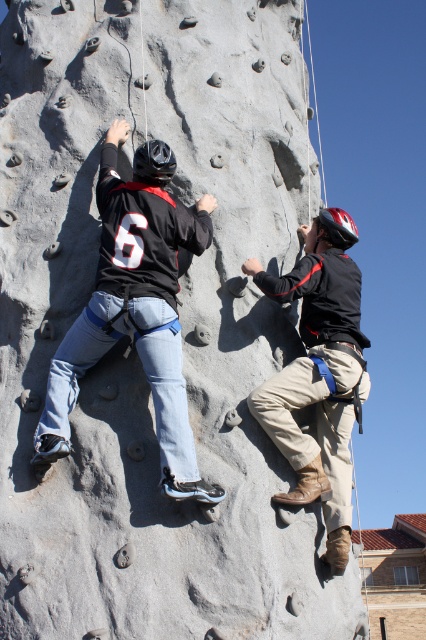
Question: From the image, what is the correct spatial relationship of matte black helmet at upper left in relation to matte black helmet at upper center?

Choices:
 (A) below
 (B) above

Answer: (B)

Question: Does matte black helmet at upper left come behind matte black helmet at upper center?

Choices:
 (A) yes
 (B) no

Answer: (B)

Question: Which object appears farthest from the camera in this image?

Choices:
 (A) matte black helmet at upper center
 (B) matte black helmet at upper left

Answer: (A)

Question: Does matte black helmet at upper left have a greater width compared to matte black helmet at upper center?

Choices:
 (A) no
 (B) yes

Answer: (B)

Question: Which object is closer to the camera taking this photo?

Choices:
 (A) matte black helmet at upper center
 (B) matte black helmet at upper left

Answer: (B)